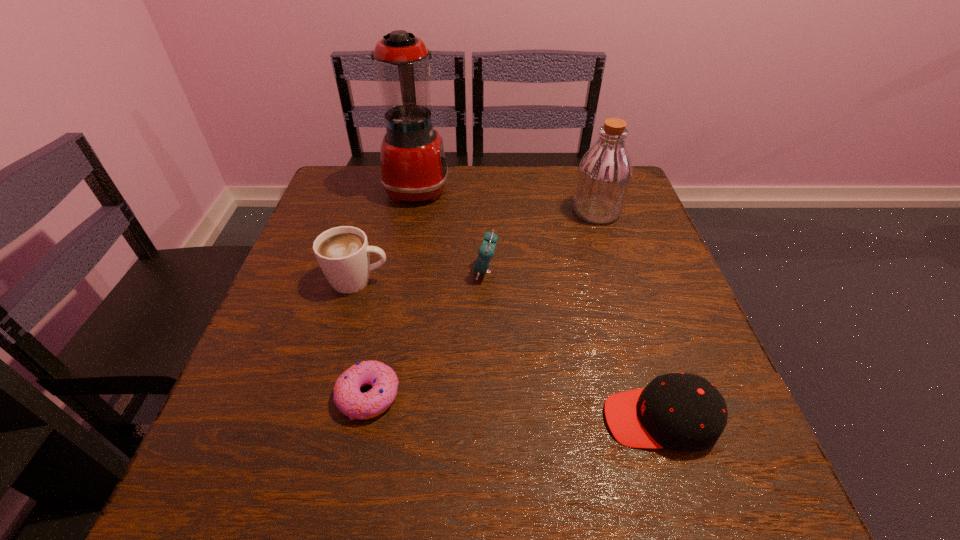
Identify the location of cappuccino that is at the left edge. (342, 252).

The width and height of the screenshot is (960, 540). What are the coordinates of `bottle at the right edge` in the screenshot? It's located at (604, 175).

This screenshot has width=960, height=540. I want to click on cap located in the right edge section of the desktop, so click(x=683, y=412).

The image size is (960, 540). Find the location of `object located at the far left corner`. object located at the far left corner is located at coordinates (413, 166).

Image resolution: width=960 pixels, height=540 pixels. I want to click on object present at the far right corner, so click(604, 175).

Where is `object that is at the near right corner`? object that is at the near right corner is located at coordinates (683, 412).

The height and width of the screenshot is (540, 960). I want to click on vacant area at the far edge, so click(x=488, y=216).

The width and height of the screenshot is (960, 540). I want to click on vacant space at the near edge of the desktop, so click(607, 498).

This screenshot has width=960, height=540. I want to click on vacant area at the left edge of the desktop, so 346,315.

The width and height of the screenshot is (960, 540). What are the coordinates of `free space at the right edge` in the screenshot? It's located at [614, 295].